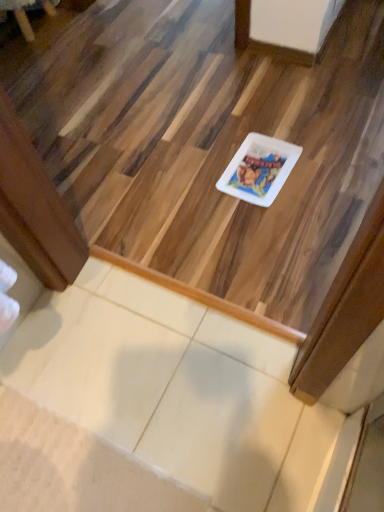
Question: From the image's perspective, is white glossy plate at center positioned above or below white glossy plate at center?

Choices:
 (A) above
 (B) below

Answer: (B)

Question: Considering the relative positions of white glossy plate at center and white glossy plate at center in the image provided, is white glossy plate at center to the left or to the right of white glossy plate at center?

Choices:
 (A) left
 (B) right

Answer: (B)

Question: Considering the real-world distances, which object is farthest from the white glossy plate at center?

Choices:
 (A) white glossy plate at center
 (B) brushed metal table at upper left

Answer: (B)

Question: Which object is the closest to the white glossy plate at center?

Choices:
 (A) brushed metal table at upper left
 (B) white glossy plate at center

Answer: (B)